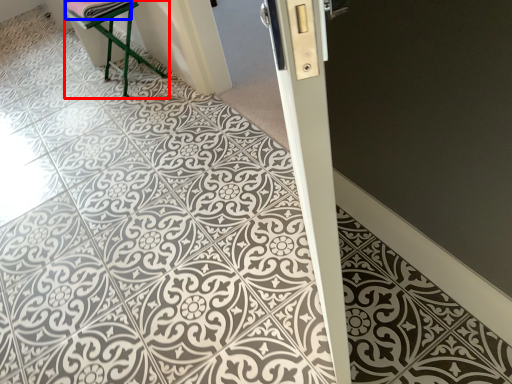
Question: Which object is closer to the camera taking this photo, furniture (highlighted by a red box) or material (highlighted by a blue box)?

Choices:
 (A) furniture
 (B) material

Answer: (B)